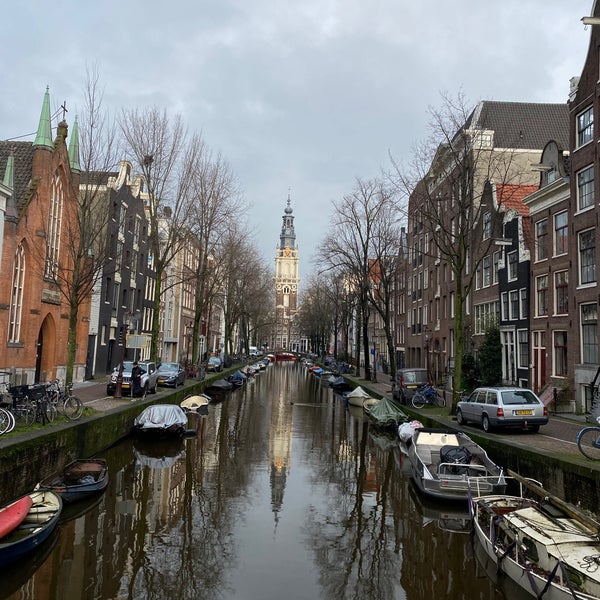
At what (x,y) coordinates should I click in order to perform the action: click on black walls. Please return your answer as a coordinate pair (x, y). The image size is (600, 600). Looking at the image, I should click on (524, 280), (504, 282), (515, 233).